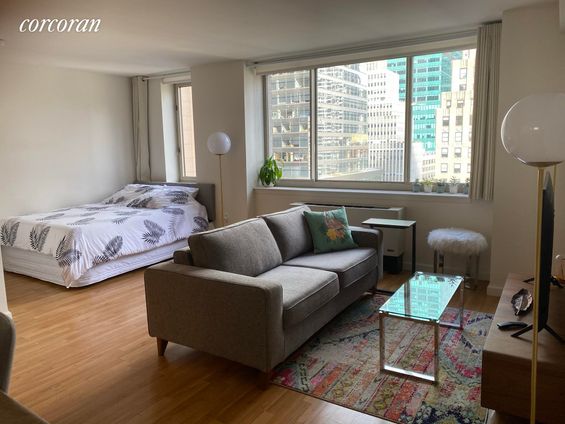
The image size is (565, 424). I want to click on sofa leg, so click(160, 344), click(262, 378), click(372, 285).